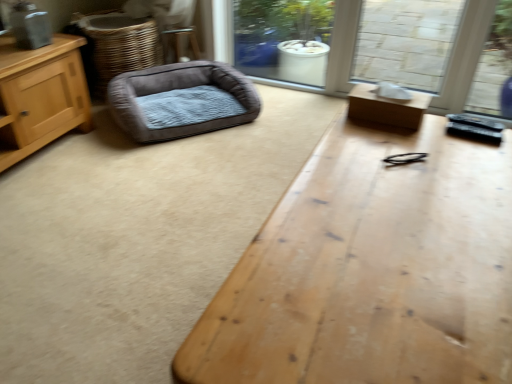
Image resolution: width=512 pixels, height=384 pixels. I want to click on free location above wooden table at center, which is the 2th table in top-to-bottom order (from a real-world perspective), so (x=399, y=225).